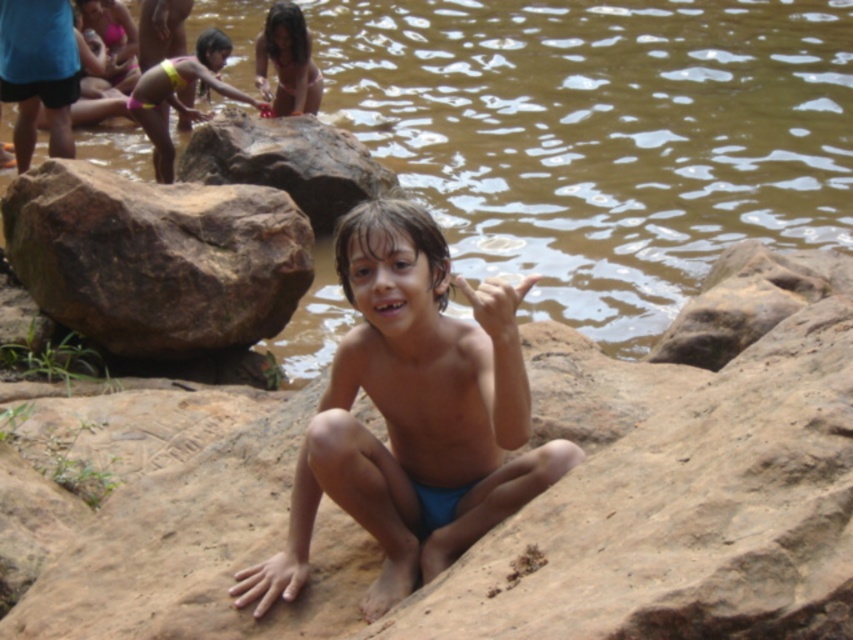
Does brown rough rock at left have a greater width compared to pink fabric bikini at upper left?

Yes.

Who is shorter, brown rough rock at left or pink fabric bikini at upper left?

Standing shorter between the two is brown rough rock at left.

Is point (155, 257) positioned after point (189, 61)?

No, (155, 257) is in front of (189, 61).

Identify the location of brown rough rock at left. The width and height of the screenshot is (853, 640). (155, 257).

Does point (164, 154) come closer to viewer compared to point (291, 68)?

Yes, it is.

Does point (137, 100) come closer to viewer compared to point (265, 28)?

Yes.

Identify the location of pink fabric bikini at upper left. The height and width of the screenshot is (640, 853). (178, 97).

Measure the distance between brown rough rock at left and camera.

brown rough rock at left and camera are 5.93 meters apart.

Is brown rough rock at left to the right of brown rough rock at center-left from the viewer's perspective?

In fact, brown rough rock at left is to the left of brown rough rock at center-left.

Locate an element on the screen. brown rough rock at left is located at coordinates (155, 257).